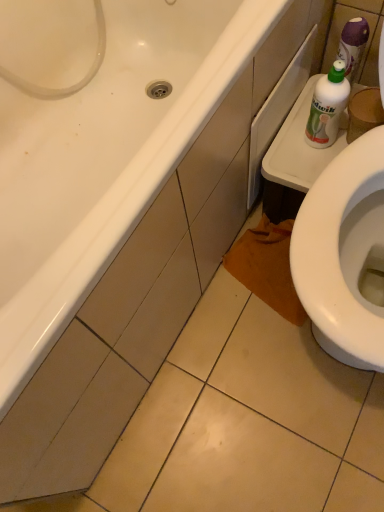
Find the location of a particular element. white glossy bathtub at upper left is located at coordinates (105, 158).

Describe the element at coordinates (105, 158) in the screenshot. The width and height of the screenshot is (384, 512). I see `white glossy bathtub at upper left` at that location.

In order to face green plastic bottle at upper right, should I rotate leftwards or rightwards?

To face it directly, rotate right by 17.514 degrees.

What do you see at coordinates (327, 106) in the screenshot?
I see `green plastic bottle at upper right` at bounding box center [327, 106].

At what (x,y) coordinates should I click in order to perform the action: click on green plastic bottle at upper right. Please return your answer as a coordinate pair (x, y). The width and height of the screenshot is (384, 512). Looking at the image, I should click on (327, 106).

Find the location of `white glossy bathtub at upper left`. white glossy bathtub at upper left is located at coordinates (x=105, y=158).

Would you say white glossy bathtub at upper left is to the left or to the right of green plastic bottle at upper right in the picture?

white glossy bathtub at upper left is to the left of green plastic bottle at upper right.

Is the depth of white glossy bathtub at upper left greater than that of green plastic bottle at upper right?

No, it is in front of green plastic bottle at upper right.

Which point is more distant from viewer, (11, 48) or (332, 121)?

The point (11, 48) is farther from the camera.

From the image's perspective, is white glossy bathtub at upper left beneath green plastic bottle at upper right?

Yes.

From a real-world perspective, is white glossy bathtub at upper left positioned above or below green plastic bottle at upper right?

From a real-world perspective, white glossy bathtub at upper left is physically below green plastic bottle at upper right.

Between white glossy bathtub at upper left and green plastic bottle at upper right, which one has larger width?

white glossy bathtub at upper left is wider.

Based on the photo, between white glossy bathtub at upper left and green plastic bottle at upper right, which one has more height?

white glossy bathtub at upper left is taller.

Considering the relative sizes of white glossy bathtub at upper left and green plastic bottle at upper right in the image provided, is white glossy bathtub at upper left bigger than green plastic bottle at upper right?

Correct, white glossy bathtub at upper left is larger in size than green plastic bottle at upper right.

Is white glossy bathtub at upper left surrounding green plastic bottle at upper right?

No, white glossy bathtub at upper left does not contain green plastic bottle at upper right.

Is the surface of white glossy bathtub at upper left in direct contact with green plastic bottle at upper right?

No, white glossy bathtub at upper left is not making contact with green plastic bottle at upper right.

Could you tell me if white glossy bathtub at upper left is turned towards green plastic bottle at upper right?

Yes, white glossy bathtub at upper left is facing green plastic bottle at upper right.

Consider the image. Can you tell me how much white glossy bathtub at upper left and green plastic bottle at upper right differ in facing direction?

There is a 90-degree angle between the facing directions of white glossy bathtub at upper left and green plastic bottle at upper right.

How far apart are white glossy bathtub at upper left and green plastic bottle at upper right?

white glossy bathtub at upper left is 20.58 inches from green plastic bottle at upper right.

Find the location of a particular element. Image resolution: width=384 pixels, height=512 pixels. bathtub below the green plastic bottle at upper right (from a real-world perspective) is located at coordinates (105, 158).

Based on their positions, is green plastic bottle at upper right located to the left or right of white glossy bathtub at upper left?

In the image, green plastic bottle at upper right appears on the right side of white glossy bathtub at upper left.

Considering the relative positions of green plastic bottle at upper right and white glossy bathtub at upper left in the image provided, is green plastic bottle at upper right in front of white glossy bathtub at upper left?

No, it is behind white glossy bathtub at upper left.

Does point (317, 126) appear closer or farther from the camera than point (100, 161)?

Point (317, 126).

In the scene shown: From the image's perspective, is green plastic bottle at upper right located above or below white glossy bathtub at upper left?

green plastic bottle at upper right is above white glossy bathtub at upper left.

Consider the image. From a real-world perspective, is green plastic bottle at upper right on top of white glossy bathtub at upper left?

Indeed, from a real-world perspective, green plastic bottle at upper right stands above white glossy bathtub at upper left.

In the scene shown: Does green plastic bottle at upper right have a lesser width compared to white glossy bathtub at upper left?

Correct, the width of green plastic bottle at upper right is less than that of white glossy bathtub at upper left.

Does green plastic bottle at upper right have a lesser height compared to white glossy bathtub at upper left?

Correct, green plastic bottle at upper right is not as tall as white glossy bathtub at upper left.

Is green plastic bottle at upper right smaller than white glossy bathtub at upper left?

Yes.

Is green plastic bottle at upper right located outside white glossy bathtub at upper left?

Yes, green plastic bottle at upper right is located beyond the bounds of white glossy bathtub at upper left.

Is there a large distance between green plastic bottle at upper right and white glossy bathtub at upper left?

green plastic bottle at upper right is near white glossy bathtub at upper left, not far away.

Is green plastic bottle at upper right aimed at white glossy bathtub at upper left?

No, green plastic bottle at upper right is not facing towards white glossy bathtub at upper left.

How different are the orientations of green plastic bottle at upper right and white glossy bathtub at upper left in degrees?

90 degrees.

Measure the distance between green plastic bottle at upper right and white glossy bathtub at upper left.

green plastic bottle at upper right and white glossy bathtub at upper left are 20.58 inches apart from each other.

The image size is (384, 512). I want to click on bottle on the right of white glossy bathtub at upper left, so click(327, 106).

The image size is (384, 512). What are the coordinates of `bottle located on the right of white glossy bathtub at upper left` in the screenshot? It's located at (x=327, y=106).

Locate an element on the screen. bathtub on the left of green plastic bottle at upper right is located at coordinates (105, 158).